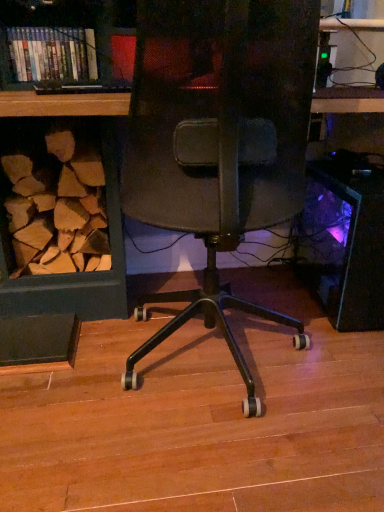
This screenshot has width=384, height=512. Identify the location of free space in front of black plastic desktop at right. (326, 357).